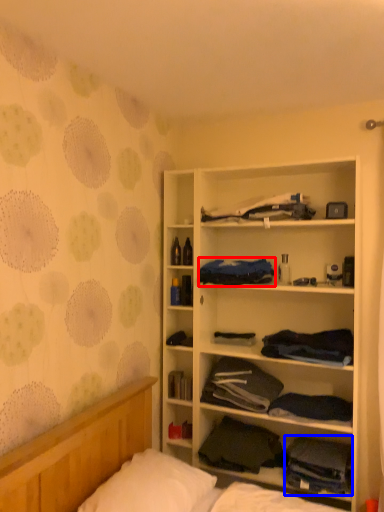
Question: Which object appears closest to the camera in this image, clothing (highlighted by a red box) or clothing (highlighted by a blue box)?

Choices:
 (A) clothing
 (B) clothing

Answer: (B)